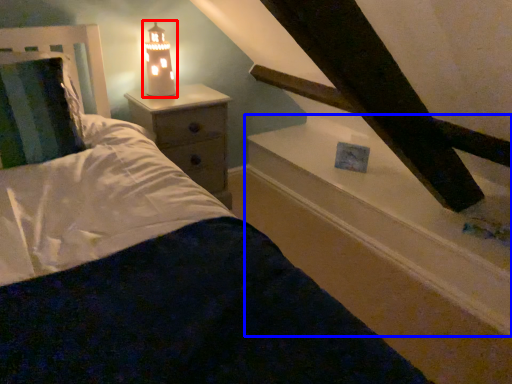
Question: Among these objects, which one is nearest to the camera, lamp (highlighted by a red box) or window sill (highlighted by a blue box)?

Choices:
 (A) lamp
 (B) window sill

Answer: (B)